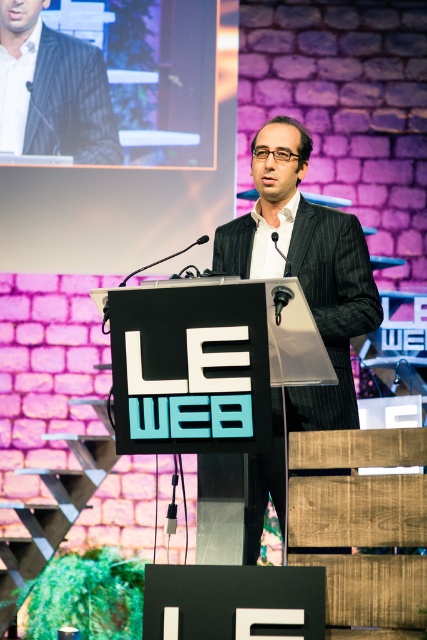
You are organizing a formal event and need to place two speakers on stage. One speaker is wearing a dark gray pinstripe suit at center, and the other is wearing a matte black suit at upper left. According to the scene, which speaker is positioned to the right of the other?

The dark gray pinstripe suit at center is positioned to the right of the matte black suit at upper left.

You are organizing a formal event and need to decide which suit to wear. The dark gray pinstripe suit at center and the matte black suit at upper left are options. Based on their sizes, which one would be more appropriate for a taller person?

The dark gray pinstripe suit at center has a greater height compared to the matte black suit at upper left, so it would be more appropriate for a taller person.